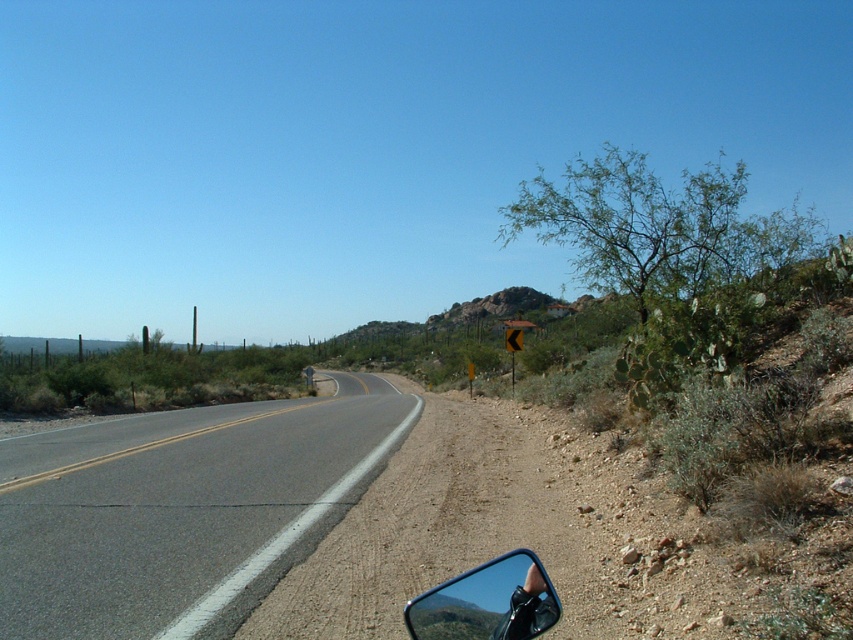
Question: Is asphalt road at left thinner than dirt road at lower left?

Choices:
 (A) yes
 (B) no

Answer: (B)

Question: Does asphalt road at left have a greater width compared to dirt road at lower left?

Choices:
 (A) yes
 (B) no

Answer: (A)

Question: Estimate the real-world distances between objects in this image. Which object is farther from the black rubber view mirror at lower right?

Choices:
 (A) dirt road at lower left
 (B) asphalt road at left

Answer: (B)

Question: Which is nearer to the dirt road at lower left?

Choices:
 (A) black rubber view mirror at lower right
 (B) asphalt road at left

Answer: (B)

Question: Considering the real-world distances, which object is farthest from the asphalt road at left?

Choices:
 (A) dirt road at lower left
 (B) black rubber view mirror at lower right

Answer: (B)

Question: Can you confirm if dirt road at lower left is positioned to the left of black rubber view mirror at lower right?

Choices:
 (A) yes
 (B) no

Answer: (B)